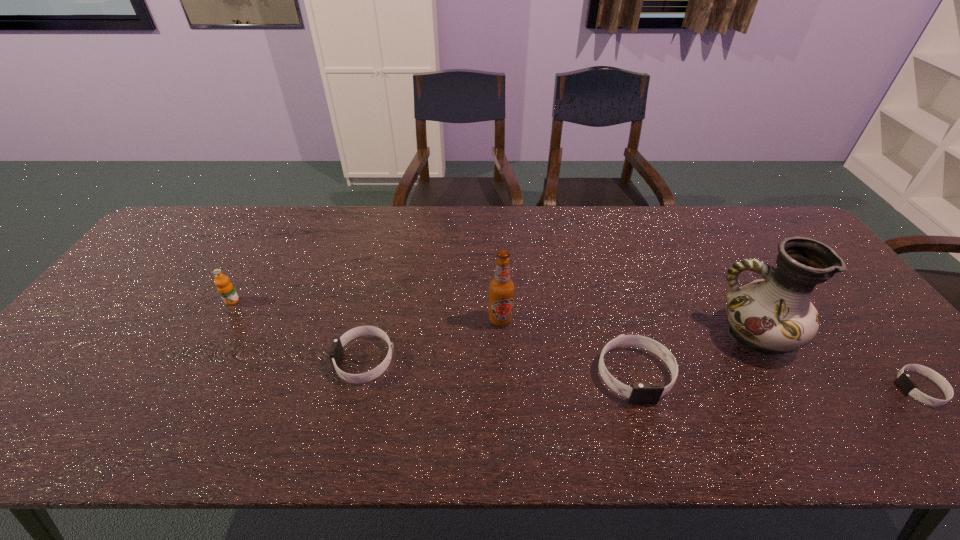
This screenshot has width=960, height=540. I want to click on object positioned at the right edge, so click(904, 381).

Identify the location of object present at the near right corner. Image resolution: width=960 pixels, height=540 pixels. (904, 381).

The height and width of the screenshot is (540, 960). In the image, there is a desktop. Identify the location of free space at the far edge. (640, 210).

The width and height of the screenshot is (960, 540). In the image, there is a desktop. What are the coordinates of `vacant region at the near edge` in the screenshot? It's located at (687, 404).

This screenshot has width=960, height=540. In order to click on vacant space at the left edge of the desktop in this screenshot , I will do `click(89, 327)`.

At what (x,y) coordinates should I click in order to perform the action: click on free space at the far left corner of the desktop. Please return your answer as a coordinate pair (x, y). The width and height of the screenshot is (960, 540). Looking at the image, I should click on (214, 211).

Where is `vacant space at the far right corner`? Image resolution: width=960 pixels, height=540 pixels. vacant space at the far right corner is located at coordinates (761, 224).

Where is `empty space that is in between the tallest object and the second wristband from right to left`? empty space that is in between the tallest object and the second wristband from right to left is located at coordinates (695, 354).

Find the location of a particular element. free space that is in between the second wristband from right to left and the shortest object is located at coordinates (777, 381).

At what (x,y) coordinates should I click in order to perform the action: click on vacant area that lies between the second wristband from left to right and the shortest object. Please return your answer as a coordinate pair (x, y). This screenshot has height=540, width=960. Looking at the image, I should click on click(777, 381).